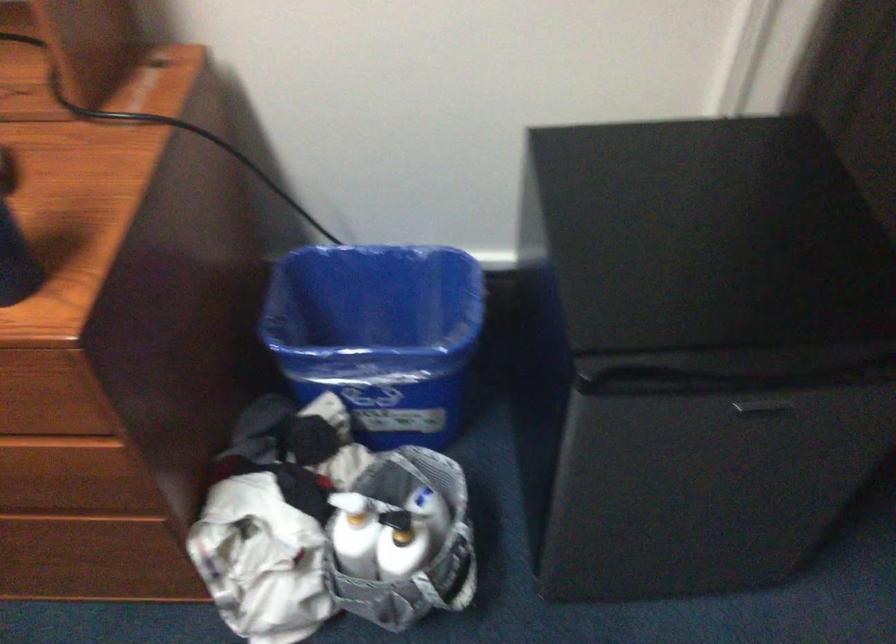
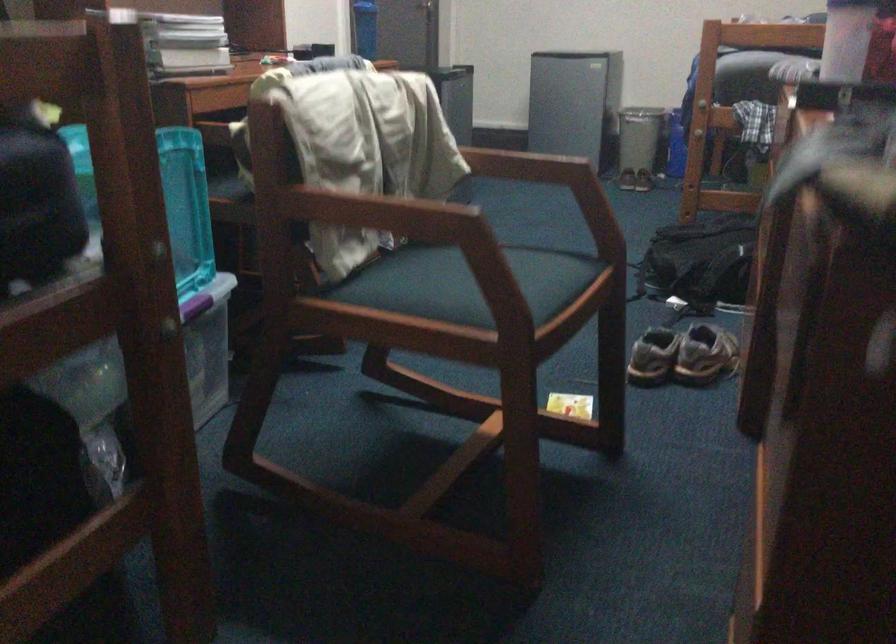
Question: I am providing you with two images of the same scene from different viewpoints. Please identify which objects are invisible in image2.

Choices:
 (A) blue water bottle
 (B) black backpack
 (C) white bottle pump
 (D) green whiteboard eraser

Answer: (C)